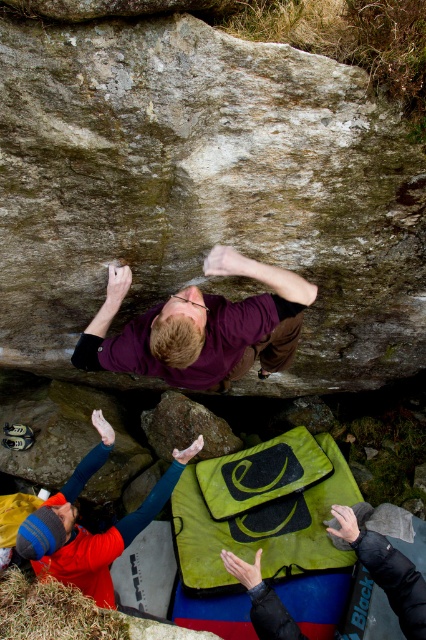
You are a photographer taking a picture of the rock climbing scene. You want to ensure both the purple matte shirt at upper center and the yellow fleece jacket at lower left are visible in your shot. Based on their positions, which one should you focus on first to frame the shot properly?

The purple matte shirt at upper center is positioned over the yellow fleece jacket at lower left, so you should focus on the purple matte shirt at upper center first to ensure it stays in frame while adjusting for the lower positioned yellow fleece jacket at lower left.

You are a photographer standing in front of the rock climbing scene. You want to take a photo that includes both the climber and the two observers. The two points in the image, point (166, 333) and point (129, 540), mark the positions where you can place your camera to capture the best angles. Which point should you choose to ensure that the climber appears closer to the camera than the observers?

Point (166, 333) is closer to the viewer than point (129, 540), so choosing point (166, 333) will place the camera closer to the climber, making them appear closer to the camera than the observers.

You are a photographer positioned at the camera. You want to capture a closeup shot of the purple matte shirt at upper center. Given that your camera has a minimum focusing distance of 5 feet, can you take the photo without moving closer?

The distance of purple matte shirt at upper center from camera is 6.92 feet, which is greater than the minimum focusing distance of 5 feet. Therefore, you can take the closeup shot without moving closer.